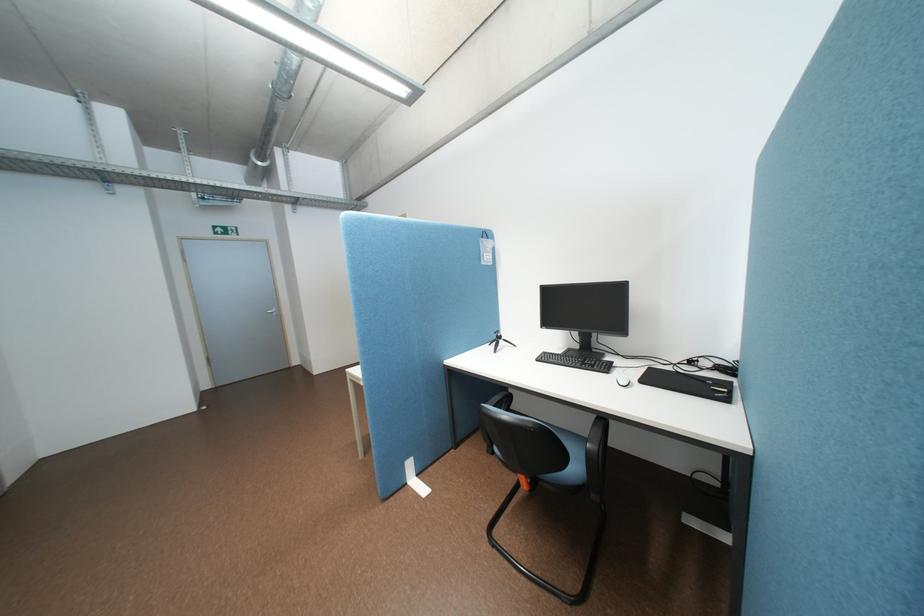
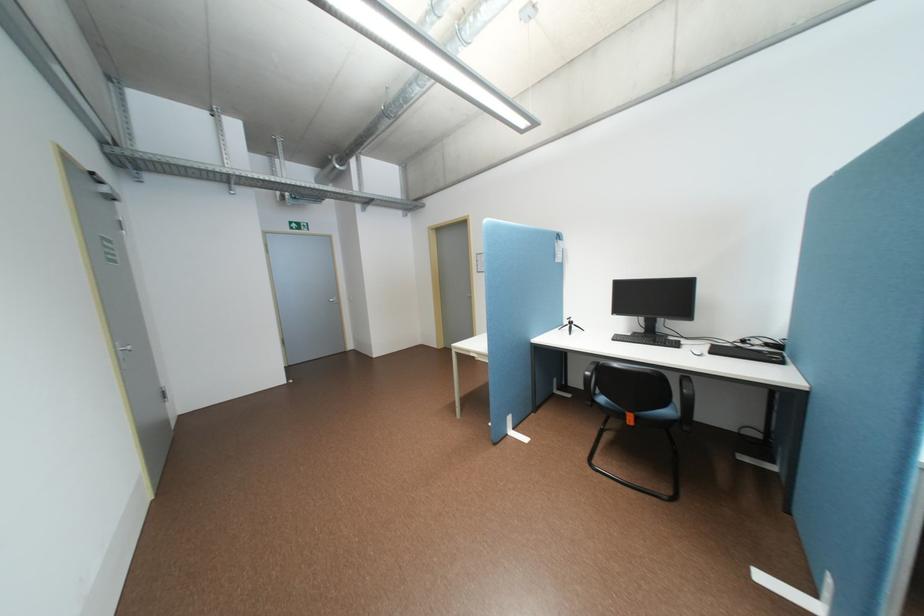
Where in the second image is the point corresponding to (x=306, y=201) from the first image?

(379, 201)